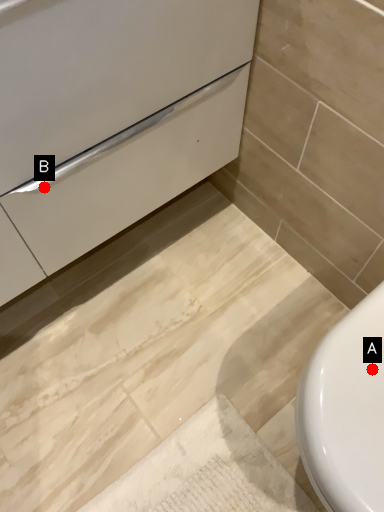
Question: Two points are circled on the image, labeled by A and B beside each circle. Among these points, which one is farthest from the camera?

Choices:
 (A) A is further
 (B) B is further

Answer: (B)